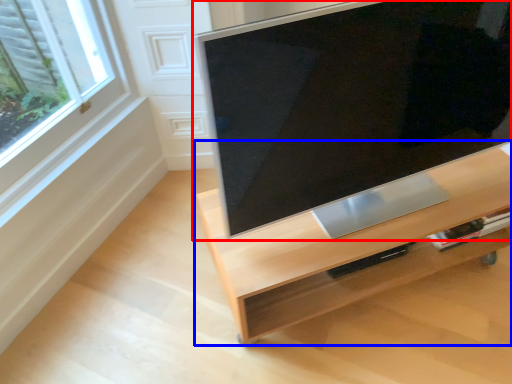
Question: Which object appears closest to the camera in this image, television (highlighted by a red box) or furniture (highlighted by a blue box)?

Choices:
 (A) television
 (B) furniture

Answer: (A)